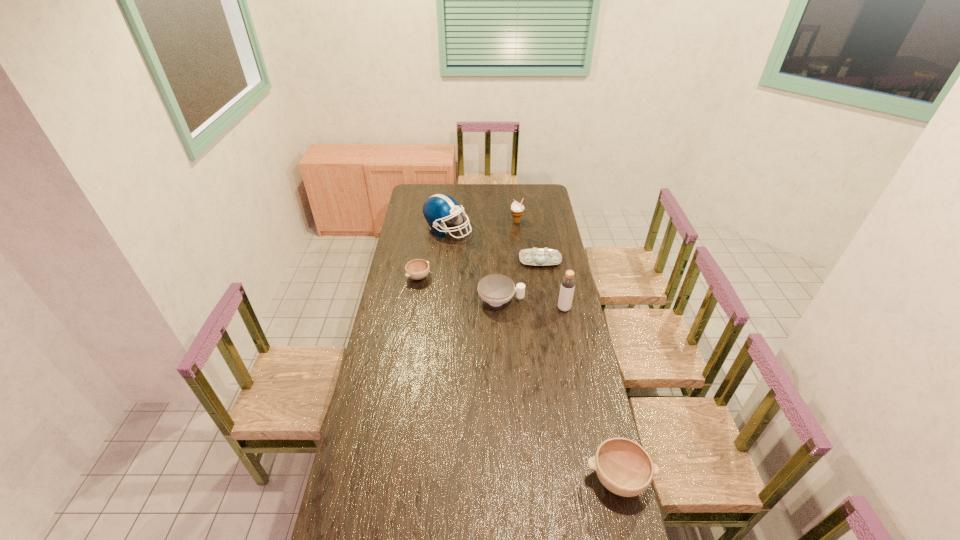
Where is `bottle that is positioned at the right edge`? The width and height of the screenshot is (960, 540). bottle that is positioned at the right edge is located at coordinates (568, 281).

Identify the location of free space at the far edge. This screenshot has height=540, width=960. (511, 201).

I want to click on free space at the near edge, so click(479, 525).

Locate an element on the screen. Image resolution: width=960 pixels, height=540 pixels. vacant position at the left edge of the desktop is located at coordinates (375, 415).

Identify the location of vacant space at the right edge. The width and height of the screenshot is (960, 540). (547, 214).

Image resolution: width=960 pixels, height=540 pixels. In the image, there is a desktop. Identify the location of vacant space at the far left corner. (431, 192).

Where is `free spot between the nearest object and the nearer chinaware`? free spot between the nearest object and the nearer chinaware is located at coordinates (560, 389).

The height and width of the screenshot is (540, 960). I want to click on vacant point located between the nearer chinaware and the football helmet, so click(474, 265).

You are a GUI agent. You are given a task and a screenshot of the screen. Output one action in this format:
    pyautogui.click(x=<x>, y=<y>)
    Task: Click on the vacant area that lies between the third farthest object and the left bowl
    Image resolution: width=960 pixels, height=540 pixels.
    Given the screenshot: What is the action you would take?
    pyautogui.click(x=479, y=269)

Where is `vacant area that lies between the football helmet and the fifth shortest object`? vacant area that lies between the football helmet and the fifth shortest object is located at coordinates (482, 226).